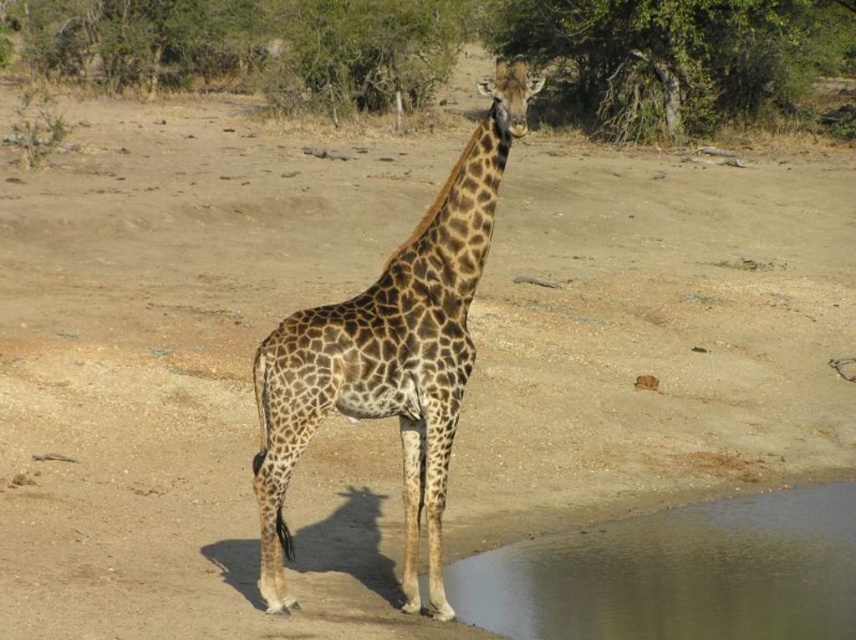
Is spotted fur giraffe at center bigger than transparent water at lower right?

Yes, spotted fur giraffe at center is bigger than transparent water at lower right.

Is point (470, 205) less distant than point (607, 545)?

Yes, it is.

Measure the distance between spotted fur giraffe at center and camera.

They are 17.75 feet apart.

In order to click on spotted fur giraffe at center in this screenshot , I will do `click(391, 353)`.